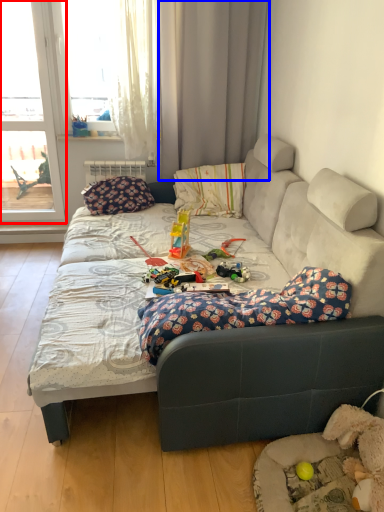
Question: Which point is closer to the camera, window (highlighted by a red box) or curtain (highlighted by a blue box)?

Choices:
 (A) window
 (B) curtain

Answer: (B)